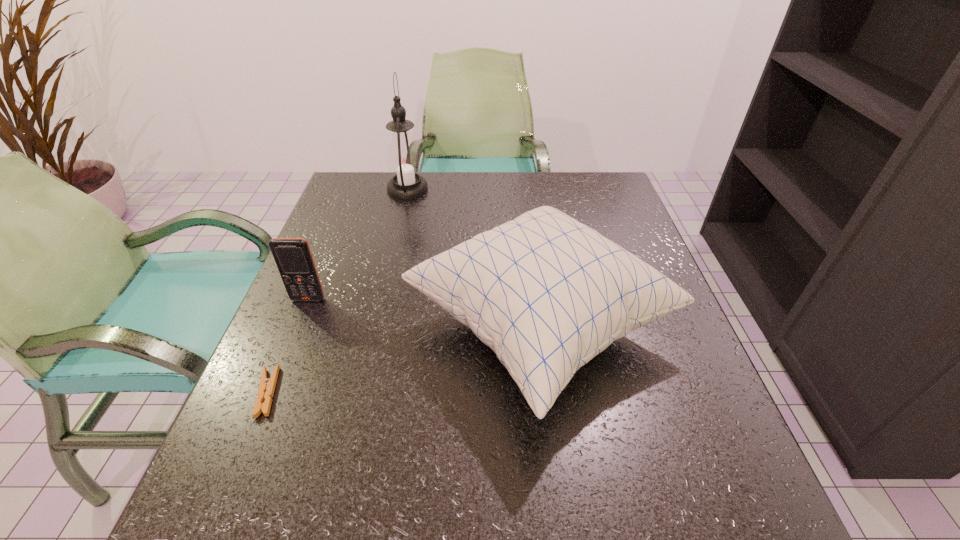
Where is `object present at the far edge`? The width and height of the screenshot is (960, 540). object present at the far edge is located at coordinates (404, 161).

The height and width of the screenshot is (540, 960). In order to click on oil lamp present at the left edge in this screenshot , I will do `click(404, 161)`.

At what (x,y) coordinates should I click in order to perform the action: click on cellular telephone present at the left edge. Please return your answer as a coordinate pair (x, y). The width and height of the screenshot is (960, 540). Looking at the image, I should click on (293, 257).

Where is `clothespin present at the left edge`? This screenshot has height=540, width=960. clothespin present at the left edge is located at coordinates (265, 393).

Locate an element on the screen. The image size is (960, 540). object at the right edge is located at coordinates (546, 293).

Find the location of a particular element. This screenshot has width=960, height=540. object that is at the far left corner is located at coordinates (404, 161).

In the image, there is a desktop. Where is `vacant space at the far edge`? The image size is (960, 540). vacant space at the far edge is located at coordinates (543, 178).

Locate an element on the screen. The width and height of the screenshot is (960, 540). vacant position at the right edge of the desktop is located at coordinates (634, 402).

I want to click on free space at the far left corner, so click(x=376, y=182).

The image size is (960, 540). What are the coordinates of `vacant space at the near left corner of the desktop` in the screenshot? It's located at (295, 495).